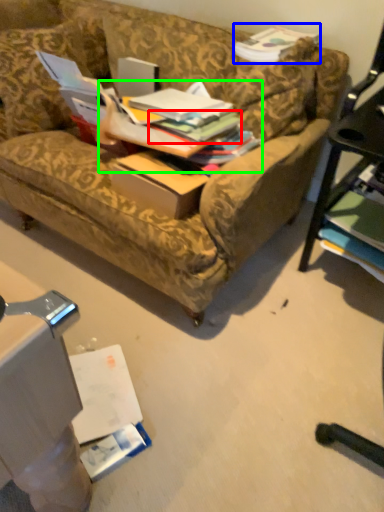
Question: Based on their relative distances, which object is farther from book (highlighted by a red box)? Choose from book (highlighted by a blue box) and book (highlighted by a green box).

Choices:
 (A) book
 (B) book

Answer: (A)